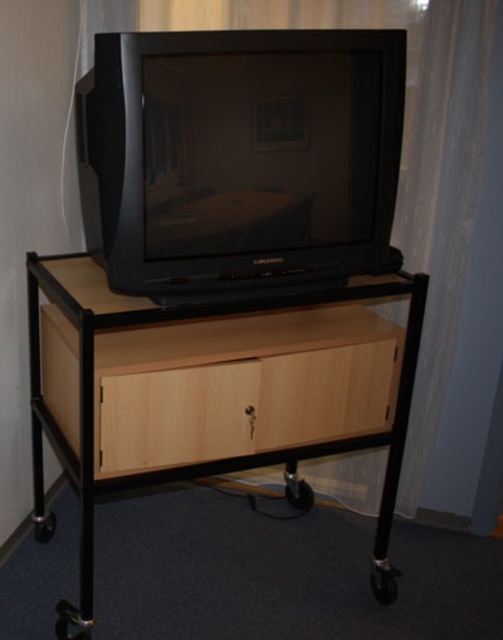
Between white sheer curtain at upper center and light wood/wooden drawer at center, which one appears on the right side from the viewer's perspective?

white sheer curtain at upper center

Which of these two, white sheer curtain at upper center or light wood/wooden drawer at center, stands shorter?

light wood/wooden drawer at center is shorter.

Where is `white sheer curtain at upper center`? The width and height of the screenshot is (503, 640). white sheer curtain at upper center is located at coordinates (x=412, y=202).

From the picture: Which of these two, black plastic television at center or white sheer curtain at upper center, stands taller?

white sheer curtain at upper center is taller.

Consider the image. Does black plastic television at center appear on the left side of white sheer curtain at upper center?

Yes, black plastic television at center is to the left of white sheer curtain at upper center.

The height and width of the screenshot is (640, 503). In order to click on black plastic television at center in this screenshot , I will do `click(242, 156)`.

Who is positioned more to the left, light wood/black metal table at center or white sheer curtain at upper center?

light wood/black metal table at center

Which of these two, light wood/black metal table at center or white sheer curtain at upper center, stands shorter?

Standing shorter between the two is light wood/black metal table at center.

You are a GUI agent. You are given a task and a screenshot of the screen. Output one action in this format:
    pyautogui.click(x=<x>, y=<y>)
    Task: Click on the light wood/black metal table at center
    The height and width of the screenshot is (640, 503).
    Given the screenshot: What is the action you would take?
    pyautogui.click(x=212, y=388)